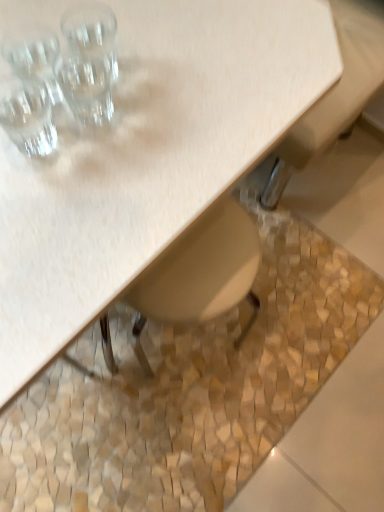
This screenshot has height=512, width=384. Find the location of `free space on the front side of transparent glass at upper left, which is the 1th shot glass in top-to-bottom order`. free space on the front side of transparent glass at upper left, which is the 1th shot glass in top-to-bottom order is located at coordinates (96, 170).